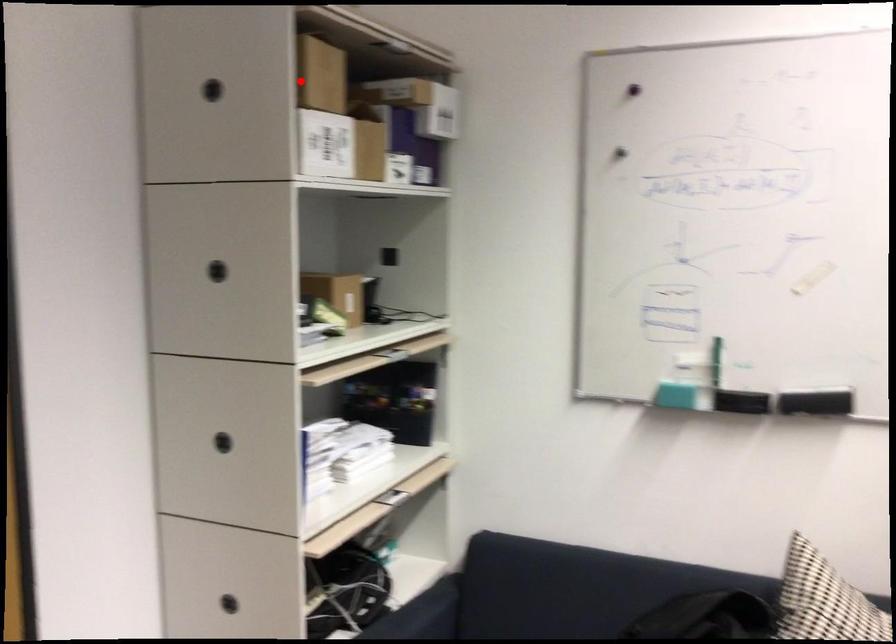
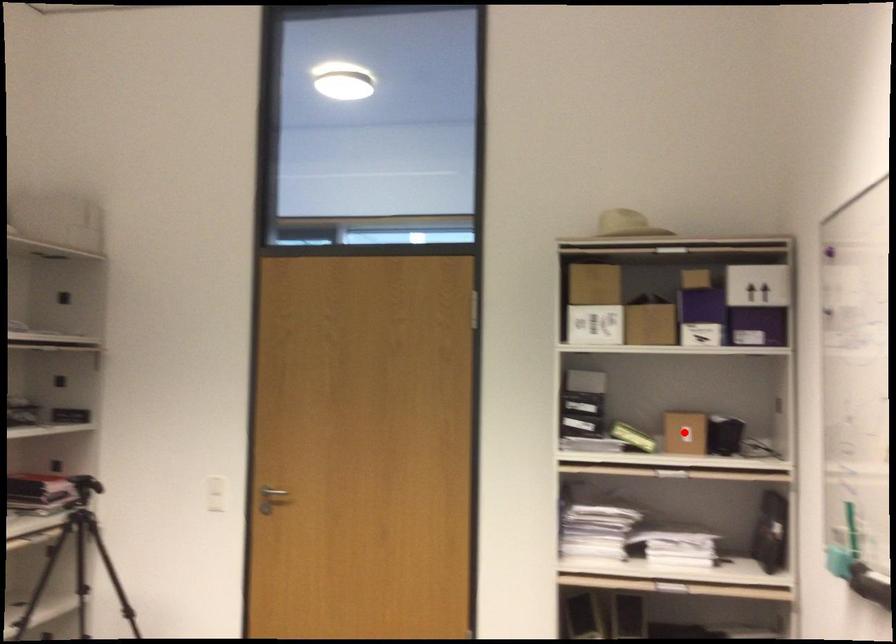
I am providing you with two images of the same scene from different viewpoints. A red point is marked on the first image and another point is marked on the second image. Is the red point in image1 aligned with the point shown in image2?

No